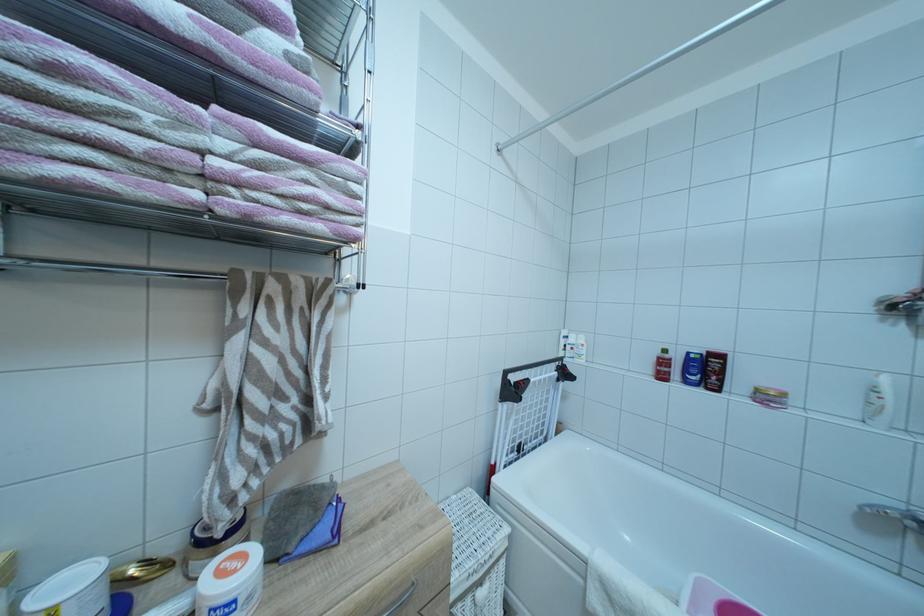
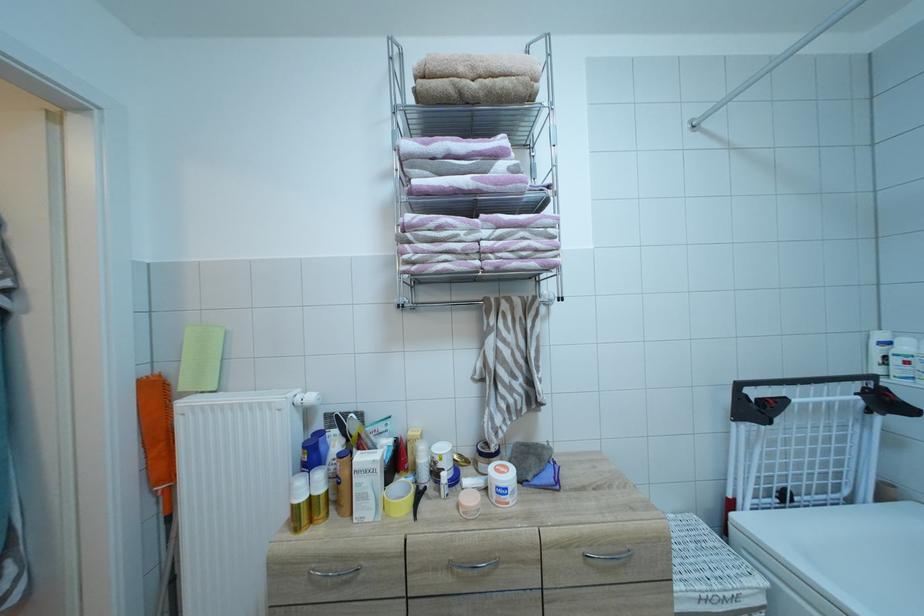
Question: How did the camera likely rotate?

Choices:
 (A) Left
 (B) Right
 (C) Up
 (D) Down

Answer: (A)